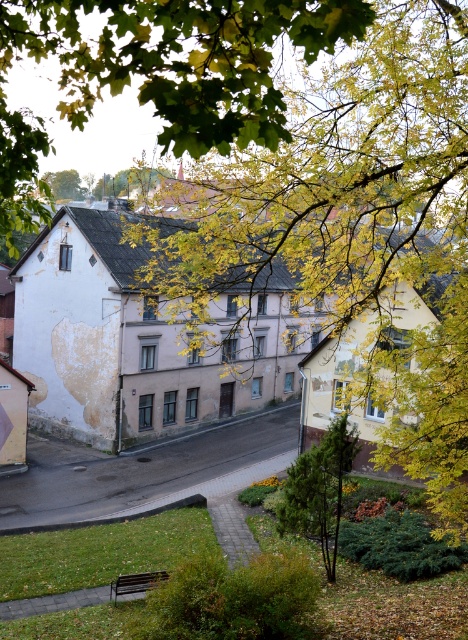
Question: Which object appears closest to the camera in this image?

Choices:
 (A) yellow leafy branches at upper center
 (B) white painted wall at left
 (C) green leafy tree at upper center

Answer: (A)

Question: Which of the following is the closest to the observer?

Choices:
 (A) (102, 376)
 (B) (162, 570)
 (C) (94, 188)

Answer: (B)

Question: Can you confirm if yellow leafy branches at upper center is wider than yellow leafy tree at upper center?

Choices:
 (A) no
 (B) yes

Answer: (B)

Question: Is yellow leafy tree at upper center below wooden park bench at lower center?

Choices:
 (A) no
 (B) yes

Answer: (A)

Question: Is yellow leafy tree at upper center positioned in front of wooden park bench at lower center?

Choices:
 (A) no
 (B) yes

Answer: (A)

Question: Which of the following is the closest to the observer?

Choices:
 (A) (114, 588)
 (B) (85, 420)
 (C) (78, 179)
 (D) (343, 84)

Answer: (D)